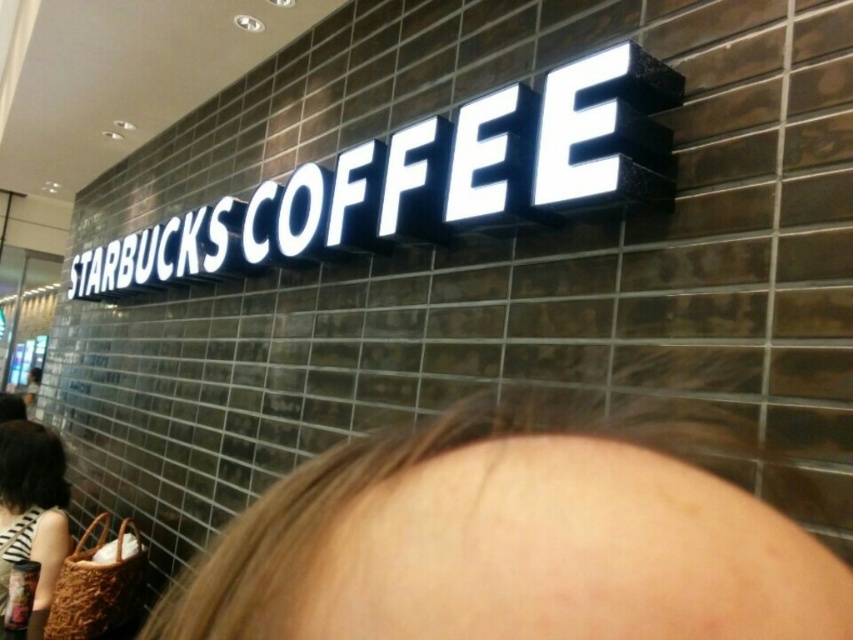
You are a customer standing outside the Starbucks Coffee shop. You notice the white glossy sign at center and the striped fabric bag at lower left. Which object is shorter in height?

The white glossy sign at center is not as tall as the striped fabric bag at lower left, so the white glossy sign at center is shorter in height.

From the picture: You are a delivery person trying to place a large package on the Starbucks Coffee shop exterior wall. The package is as wide as the striped fabric bag at lower left. Can you fit the package next to the white glossy sign at center without overlapping?

The white glossy sign at center is wider than the striped fabric bag at lower left. Since the package is as wide as the striped fabric bag at lower left, there is enough space next to the white glossy sign at center to place the package without overlapping.